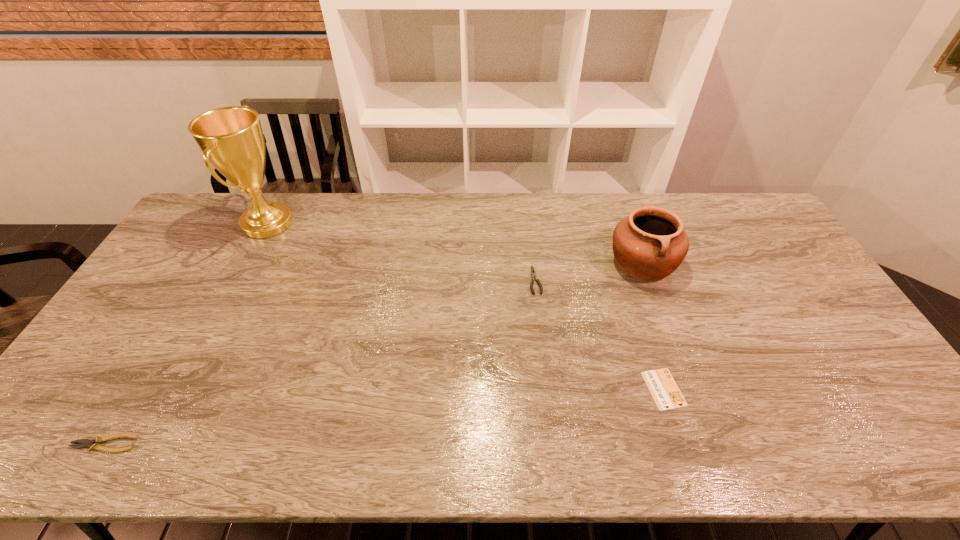
The width and height of the screenshot is (960, 540). I want to click on award, so click(x=231, y=138).

Image resolution: width=960 pixels, height=540 pixels. Find the location of `the fourth shortest object`. the fourth shortest object is located at coordinates click(650, 244).

The height and width of the screenshot is (540, 960). In order to click on the right pliers in this screenshot , I will do `click(533, 273)`.

The image size is (960, 540). I want to click on the farther pliers, so click(533, 273).

The height and width of the screenshot is (540, 960). I want to click on the nearer pliers, so click(x=94, y=444).

Locate an element on the screen. The width and height of the screenshot is (960, 540). the left pliers is located at coordinates (94, 444).

The width and height of the screenshot is (960, 540). I want to click on identity card, so click(664, 390).

You are a GUI agent. You are given a task and a screenshot of the screen. Output one action in this format:
    pyautogui.click(x=<x>, y=<y>)
    Task: Click on the second nearest object
    
    Given the screenshot: What is the action you would take?
    pyautogui.click(x=664, y=390)

The image size is (960, 540). I want to click on free region located by the handles of the award, so click(x=379, y=224).

Find the location of a particular element. free region located on the front of the second tallest object is located at coordinates (658, 306).